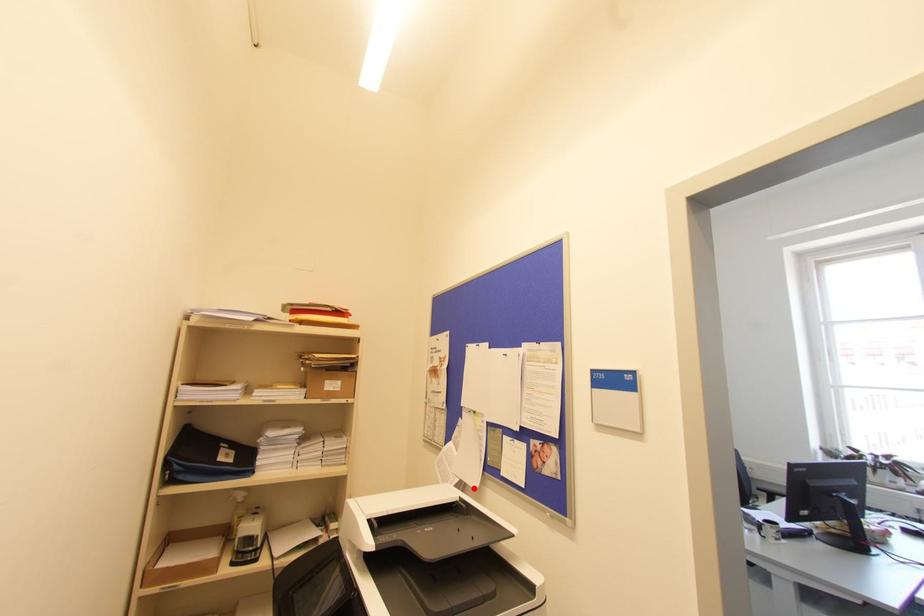
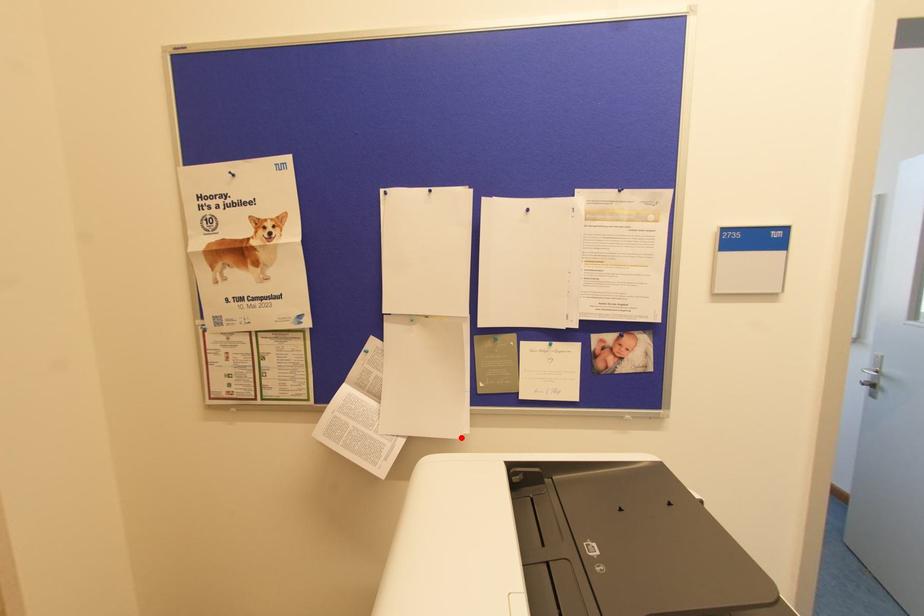
I am providing you with two images of the same scene from different viewpoints. A red point is marked on the first image and another point is marked on the second image. Are the points marked in image1 and image2 representing the same 3D position?

Yes